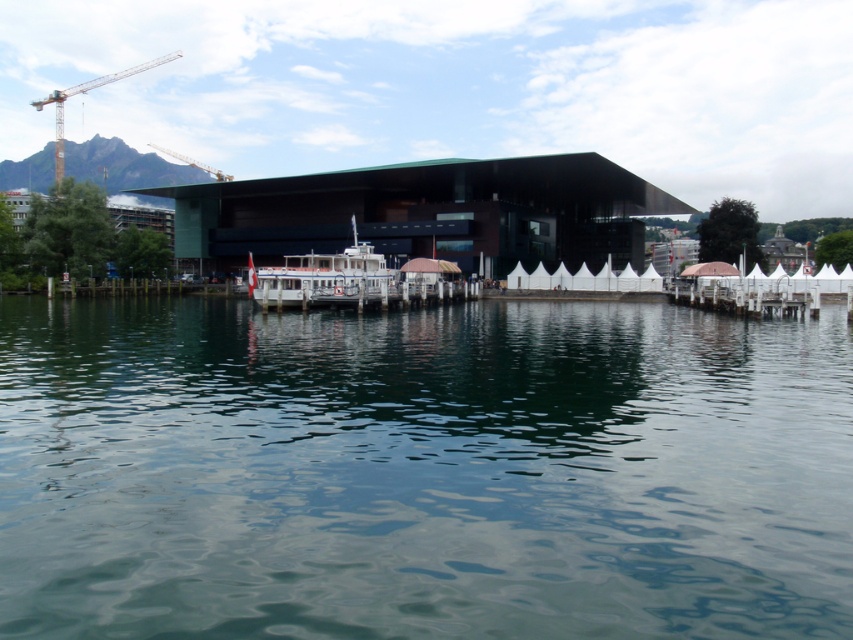
You are a city planner assessing the waterfront area. You need to determine if there is enough space to add a new small boat similar in size to the white matte boat at center next to the metallic construction crane at upper left. Based on the current layout, can you fit another boat of the same size there?

The white matte boat at center occupies less space than the metallic construction crane at upper left. Since the crane takes up more space, there might be sufficient room to place another boat of the same size next to it, but this depends on the exact dimensions and layout constraints not specified here.

You are a visitor standing at the waterfront and see the yellow metal crane at upper left and the metallic construction crane at upper left. Which one is positioned more to the left side?

The yellow metal crane at upper left is positioned more to the left side than the metallic construction crane at upper left.

You are standing on the dock and see the green liquid water at center marked by point (x=422, y=472). Can you confirm if this point is located in the water?

Yes, the green liquid water at center is represented by point (x=422, y=472), so this point is indeed in the water.